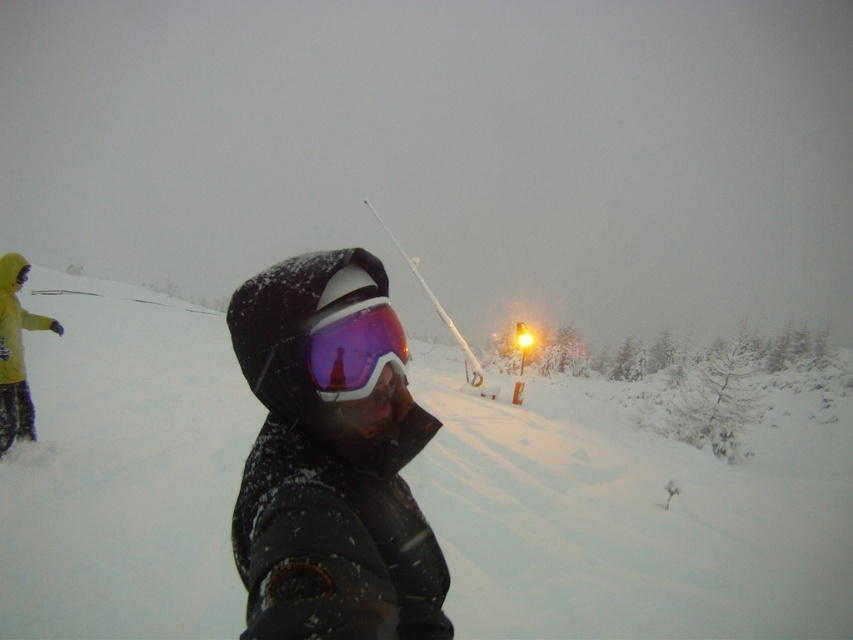
Question: Which point is farther to the camera?

Choices:
 (A) purple reflective goggles at center
 (B) matte black jacket at center
 (C) white fluffy snow at center

Answer: (C)

Question: Does matte black jacket at center come behind yellow fabric pants at left?

Choices:
 (A) yes
 (B) no

Answer: (B)

Question: Considering the real-world distances, which object is closest to the purple reflective goggles at center?

Choices:
 (A) matte black jacket at center
 (B) yellow fabric pants at left

Answer: (A)

Question: Does white fluffy snow at center appear over yellow fabric pants at left?

Choices:
 (A) yes
 (B) no

Answer: (B)

Question: Is white fluffy snow at center above purple reflective goggles at center?

Choices:
 (A) no
 (B) yes

Answer: (A)

Question: Estimate the real-world distances between objects in this image. Which object is closer to the white fluffy snow at center?

Choices:
 (A) purple reflective goggles at center
 (B) yellow fabric pants at left

Answer: (B)